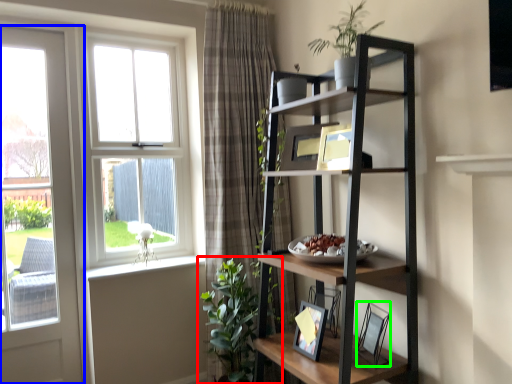
Question: Which object is the farthest from houseplant (highlighted by a red box)? Choose among these: door (highlighted by a blue box) or picture frame (highlighted by a green box).

Choices:
 (A) door
 (B) picture frame

Answer: (A)